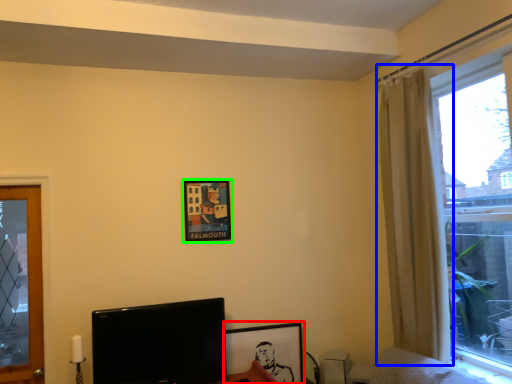
Question: Which object is the farthest from picture frame (highlighted by a red box)? Choose among these: curtain (highlighted by a blue box) or picture frame (highlighted by a green box).

Choices:
 (A) curtain
 (B) picture frame

Answer: (A)